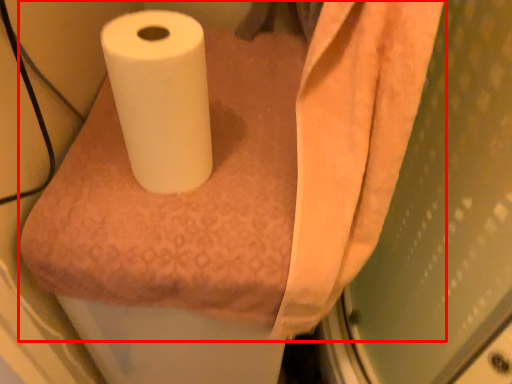
Question: Where is paper towel (annotated by the red box) located in relation to toilet paper in the image?

Choices:
 (A) right
 (B) left

Answer: (A)